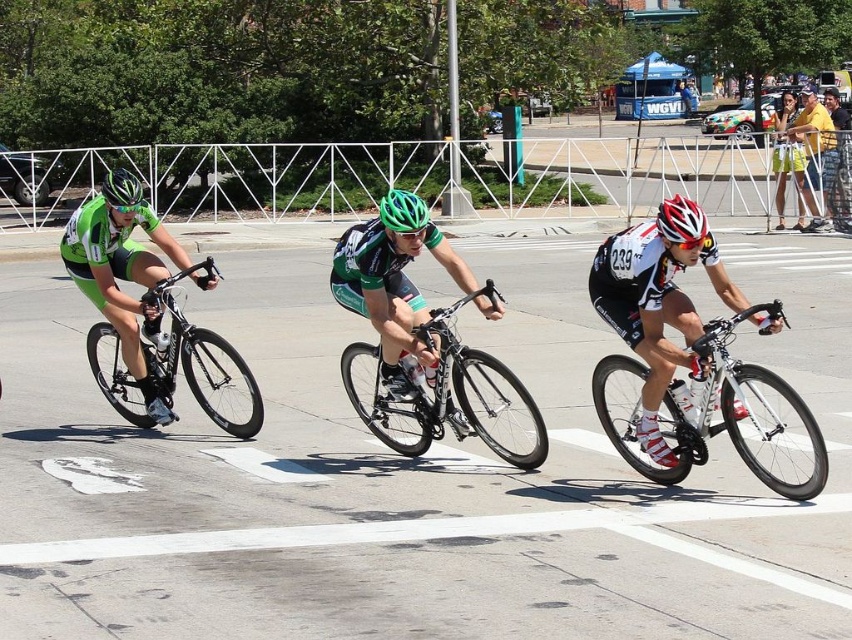
Question: Can you confirm if white matte bicycle at center is positioned to the left of yellow cotton shirt at upper right?

Choices:
 (A) no
 (B) yes

Answer: (B)

Question: Considering the real-world distances, which object is closest to the white matte bicycle helmet at center?

Choices:
 (A) white matte jersey at center
 (B) yellow cotton shirt at upper right
 (C) green fabric jersey at left

Answer: (A)

Question: Does shiny black bicycle at center appear on the right side of white matte bicycle helmet at center?

Choices:
 (A) yes
 (B) no

Answer: (B)

Question: Which point is farther to the camera?

Choices:
 (A) green fabric jersey at left
 (B) white matte jersey at center
 (C) shiny black bicycle at center
 (D) green matte bicycle helmet at left

Answer: (D)

Question: Can you confirm if yellow-green jersey at center is positioned above white matte bicycle helmet at center?

Choices:
 (A) yes
 (B) no

Answer: (A)

Question: Which of the following is the closest to the observer?

Choices:
 (A) white matte bicycle at center
 (B) yellow cotton shirt at upper right

Answer: (A)